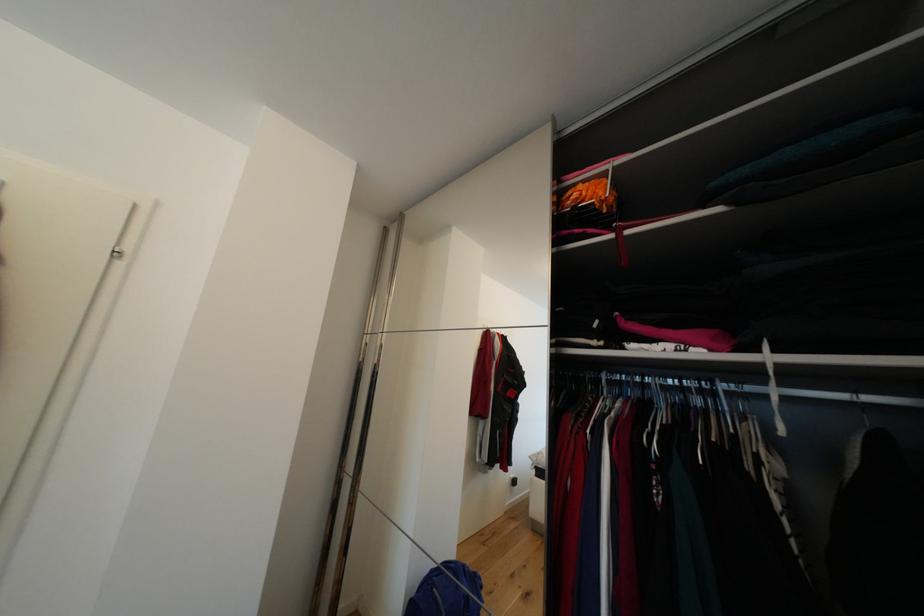
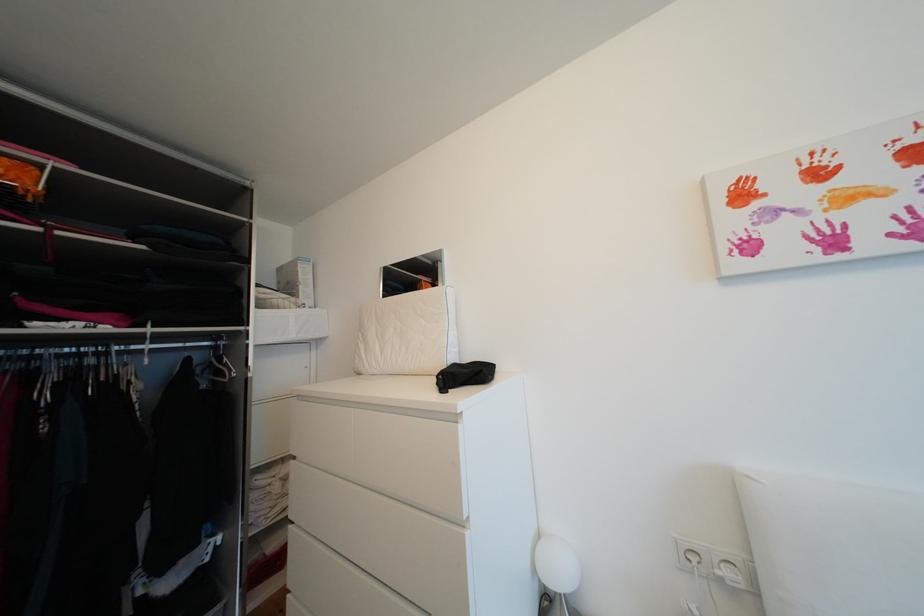
Question: The images are taken continuously from a first-person perspective. In which direction is your viewpoint rotating?

Choices:
 (A) Left
 (B) Right
 (C) Up
 (D) Down

Answer: (B)